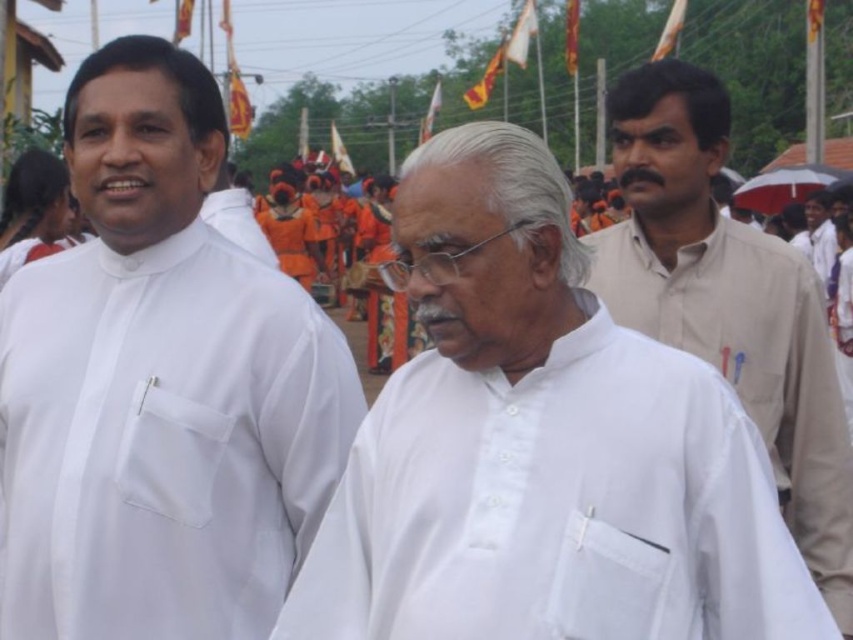
Is point (152, 177) more distant than point (641, 236)?

That is False.

Who is more forward, (x=212, y=440) or (x=811, y=538)?

Positioned in front is point (x=212, y=440).

What are the coordinates of `white matte shirt at left` in the screenshot? It's located at (160, 387).

Which of these two, white matte shirt at left or white cotton shirt at right, stands shorter?

With less height is white cotton shirt at right.

Does white matte shirt at left have a larger size compared to white cotton shirt at right?

No, white matte shirt at left is not bigger than white cotton shirt at right.

Between point (166, 506) and point (817, 209), which one is positioned in front?

Point (166, 506) is more forward.

You are a GUI agent. You are given a task and a screenshot of the screen. Output one action in this format:
    pyautogui.click(x=<x>, y=<y>)
    Task: Click on the white matte shirt at left
    This screenshot has width=853, height=640.
    Given the screenshot: What is the action you would take?
    pyautogui.click(x=160, y=387)

At what (x,y) coordinates should I click in order to perform the action: click on white cotton shirt at center. Please return your answer as a coordinate pair (x, y). This screenshot has width=853, height=640. Looking at the image, I should click on (556, 506).

Can you confirm if white cotton shirt at center is shorter than white cotton shirt at right?

Indeed, white cotton shirt at center has a lesser height compared to white cotton shirt at right.

Is point (697, 516) positioned after point (801, 244)?

No, (697, 516) is closer to viewer.

What are the coordinates of `white cotton shirt at center` in the screenshot? It's located at (556, 506).